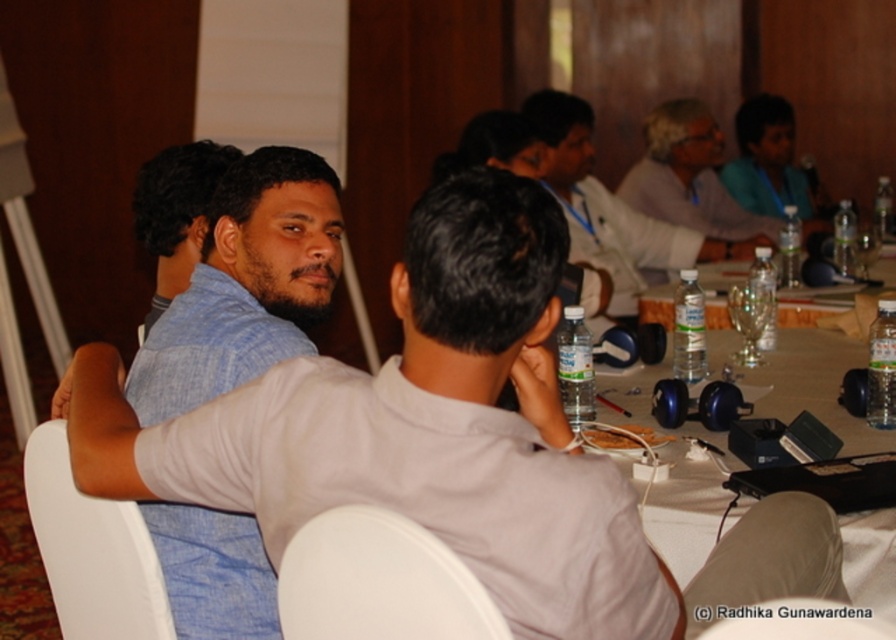
Who is more distant from viewer, (263, 237) or (830, 362)?

The point (830, 362) is behind.

Does point (237, 298) come closer to viewer compared to point (787, 342)?

Yes, it is in front of point (787, 342).

Does point (179, 376) come in front of point (785, 385)?

Yes.

You are a GUI agent. You are given a task and a screenshot of the screen. Output one action in this format:
    pyautogui.click(x=<x>, y=<y>)
    Task: Click on the blue denim shirt at left
    The width and height of the screenshot is (896, 640).
    Given the screenshot: What is the action you would take?
    pyautogui.click(x=244, y=284)

Can you confirm if light beige shirt at center is positioned to the right of light blue shirt at upper right?

Incorrect, light beige shirt at center is not on the right side of light blue shirt at upper right.

At what (x,y) coordinates should I click in order to perform the action: click on light beige shirt at center. Please return your answer as a coordinate pair (x, y). Looking at the image, I should click on (608, 209).

Is point (688, 244) in front of point (700, 209)?

That is True.

Identify the location of light beige shirt at center. (608, 209).

Is blue denim shirt at left to the right of light blue shirt at upper right from the viewer's perspective?

No, blue denim shirt at left is not to the right of light blue shirt at upper right.

Does blue denim shirt at left have a larger size compared to light blue shirt at upper right?

Incorrect, blue denim shirt at left is not larger than light blue shirt at upper right.

Is point (228, 320) more distant than point (686, 138)?

That is False.

Find the location of a particular element. Image resolution: width=896 pixels, height=640 pixels. blue denim shirt at left is located at coordinates (244, 284).